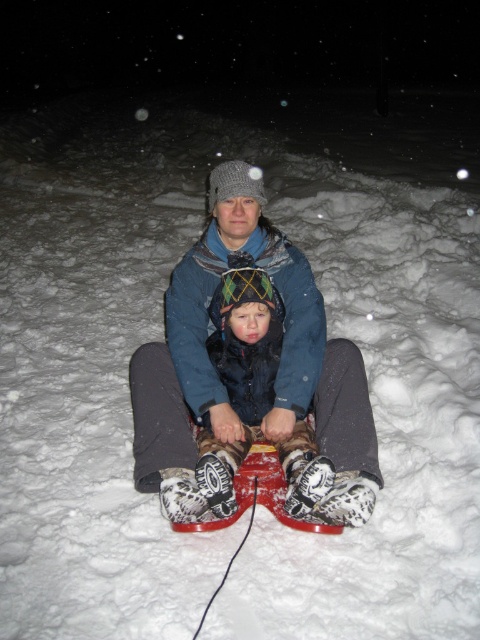
You are a fashion designer observing the winter scene. You need to determine which item is taller between the matte blue jacket at center and the plush woolen hat at center. Which one is taller?

The matte blue jacket at center is taller than the plush woolen hat at center.

You are a photographer trying to capture a closeup of both the matte blue jacket at center and the plush woolen hat at center in the winter scene. Based on their distance, can you focus on both clearly in a single shot without adjusting your camera settings?

The matte blue jacket at center is 4.38 inches away from the plush woolen hat at center. Since they are only a few inches apart, you can focus on both clearly in a single shot without needing to adjust your camera settings.